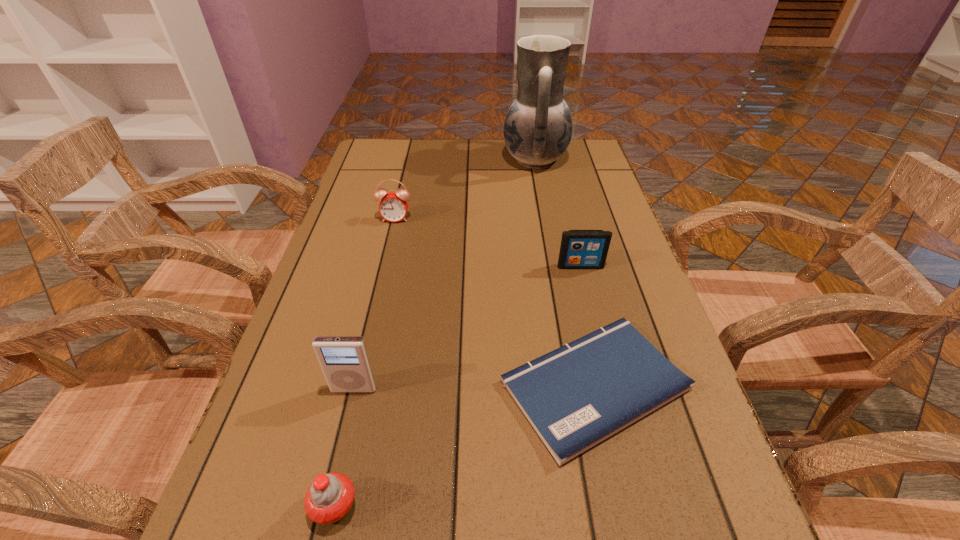
Image resolution: width=960 pixels, height=540 pixels. What are the coordinates of `object identified as the fifth closest to the farther iPod` in the screenshot? It's located at (328, 500).

I want to click on vacant space that satisfies the following two spatial constraints: 1. on the front-facing side of the farthest object; 2. on the front-facing side of the nearer iPod, so click(x=578, y=389).

Find the location of a particular element. This screenshot has width=960, height=540. vacant space that satisfies the following two spatial constraints: 1. on the back side of the paperback book; 2. on the front-facing side of the tallest object is located at coordinates (545, 160).

This screenshot has width=960, height=540. What are the coordinates of `free location that satisfies the following two spatial constraints: 1. on the front-facing side of the nearest object; 2. on the right side of the left iPod` in the screenshot? It's located at (325, 507).